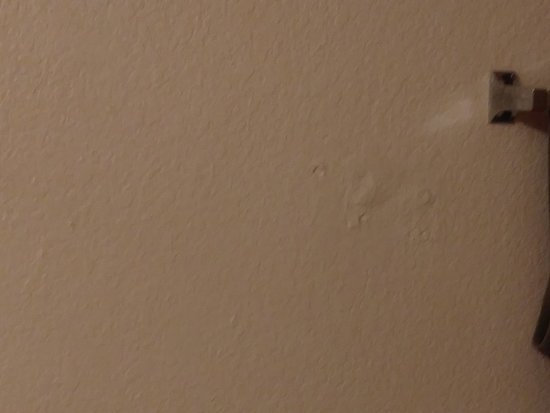
You are a GUI agent. You are given a task and a screenshot of the screen. Output one action in this format:
    pyautogui.click(x=<x>, y=<y>)
    Task: Click on the wall under towel
    This screenshot has width=550, height=413.
    Given the screenshot: What is the action you would take?
    pyautogui.click(x=543, y=387)